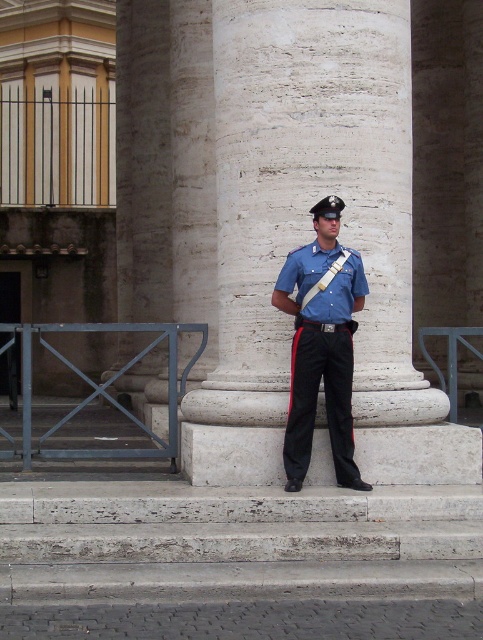
You are a maintenance worker needing to place a 6 feet long ladder between the white marble column at center and the white stone steps at center. Can the ladder fit in the space between them?

The distance between the white marble column at center and the white stone steps at center is 5.33 feet. Since the ladder is 6 feet long, it cannot fit in the space between them.

You are a photographer positioned at a certain distance from the white stone steps at center. You need to capture a photo that includes both the officer and the columns in the background. Based on the given information, is your current position far enough to include both in the frame?

The distance between the white stone steps at center and the camera is 25.81 feet. Since the officer is standing on the steps and the columns are in the background, this distance should be sufficient to include both in the frame.